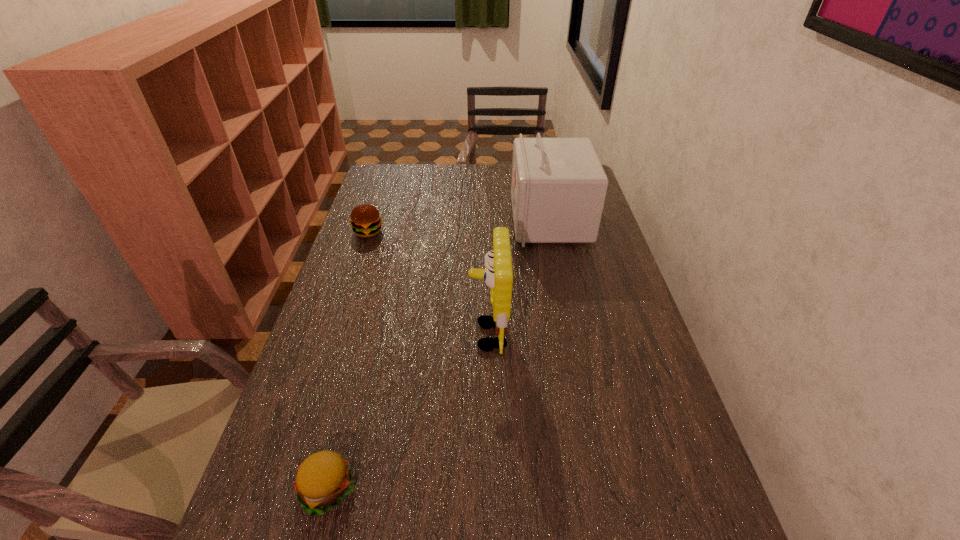
At what (x,y) coordinates should I click in order to perform the action: click on free space between the shortest object and the third object from left to right. Please return your answer as a coordinate pair (x, y). Looking at the image, I should click on (407, 413).

Image resolution: width=960 pixels, height=540 pixels. I want to click on empty space between the second object from right to left and the third tallest object, so click(428, 284).

At what (x,y) coordinates should I click in order to perform the action: click on free spot between the sponge and the farther hamburger. Please return your answer as a coordinate pair (x, y). The width and height of the screenshot is (960, 540). Looking at the image, I should click on (428, 284).

You are a GUI agent. You are given a task and a screenshot of the screen. Output one action in this format:
    pyautogui.click(x=<x>, y=<y>)
    Task: Click on the free space that is in between the nearest object and the first-aid kit
    The image size is (960, 540).
    Given the screenshot: What is the action you would take?
    pyautogui.click(x=439, y=355)

Where is `vacant area between the rightmost object and the third tallest object`? The image size is (960, 540). vacant area between the rightmost object and the third tallest object is located at coordinates (459, 226).

Find the location of a particular element. free space between the second shortest object and the rightmost object is located at coordinates (459, 226).

This screenshot has width=960, height=540. I want to click on unoccupied area between the rightmost object and the shortest object, so click(439, 355).

You are a GUI agent. You are given a task and a screenshot of the screen. Output one action in this format:
    pyautogui.click(x=<x>, y=<y>)
    Task: Click on the free space between the nearest object and the sponge
    
    Given the screenshot: What is the action you would take?
    pyautogui.click(x=407, y=413)

Find the location of a particular element. vacant area that lies between the second object from right to left and the farther hamburger is located at coordinates (428, 284).

This screenshot has height=540, width=960. Find the location of `free space between the sponge and the shortest object`. free space between the sponge and the shortest object is located at coordinates (407, 413).